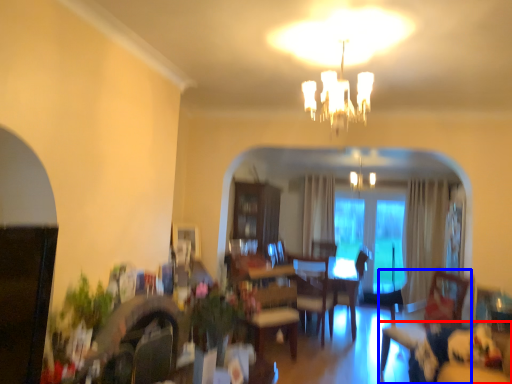
Question: Among these objects, which one is farthest to the camera, couch (highlighted by a red box) or swivel chair (highlighted by a blue box)?

Choices:
 (A) couch
 (B) swivel chair

Answer: (B)